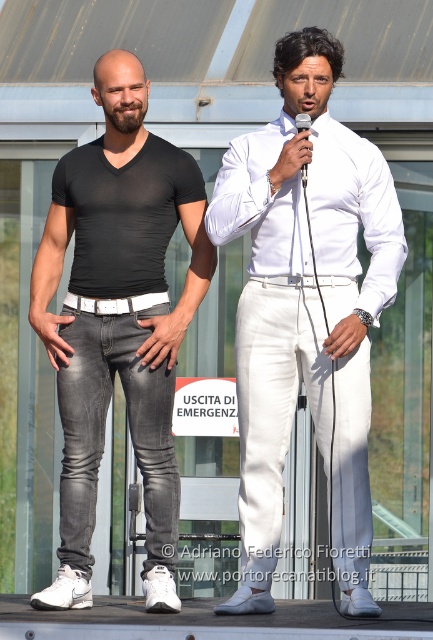
Looking at this image, is matte black t-shirt at center above dark gray denim jeans at left?

Yes, matte black t-shirt at center is above dark gray denim jeans at left.

Measure the distance between point (138, 365) and camera.

Point (138, 365) is 9.98 meters away from camera.

At what (x,y) coordinates should I click in order to perform the action: click on matte black t-shirt at center. Please return your answer as a coordinate pair (x, y). Looking at the image, I should click on (119, 321).

Which is more to the left, white linen pants at center or dark gray denim jeans at left?

Positioned to the left is dark gray denim jeans at left.

Is white linen pants at center wider than dark gray denim jeans at left?

Indeed, white linen pants at center has a greater width compared to dark gray denim jeans at left.

Between point (325, 422) and point (84, 464), which one is positioned in front?

Positioned in front is point (325, 422).

The image size is (433, 640). Find the location of `white linen pants at center`. white linen pants at center is located at coordinates (306, 308).

How distant is white linen pants at center from white satin shirt at center?

white linen pants at center and white satin shirt at center are 16.68 centimeters apart.

Is white linen pants at center thinner than white satin shirt at center?

Yes.

Which is behind, point (275, 428) or point (354, 260)?

Positioned behind is point (354, 260).

I want to click on white linen pants at center, so click(x=306, y=308).